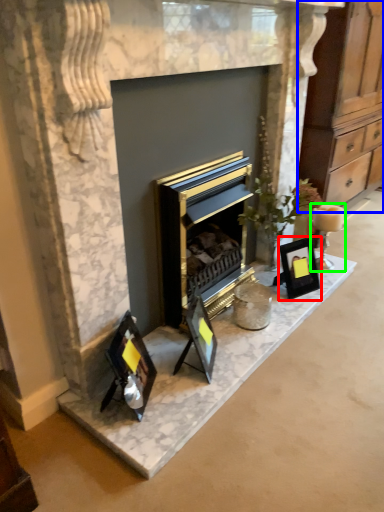
Question: Estimate the real-world distances between objects in this image. Which object is farther from picture frame (highlighted by a red box), dresser (highlighted by a blue box) or candle holder (highlighted by a green box)?

Choices:
 (A) dresser
 (B) candle holder

Answer: (A)